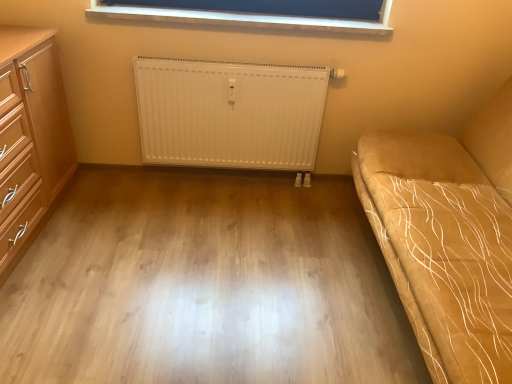
Identify the location of vacant area on top of light wood floor at center (from a real-world perspective). The image size is (512, 384). (158, 260).